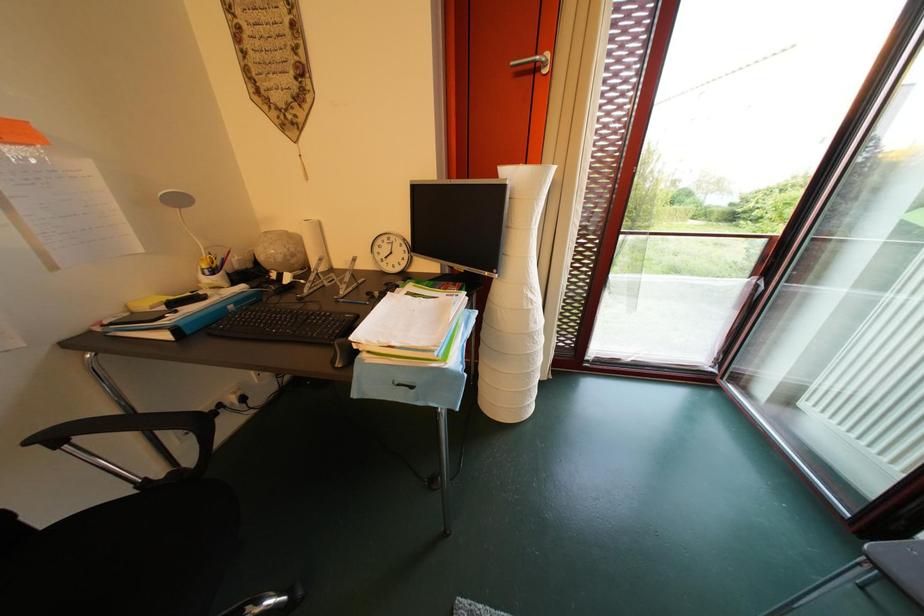
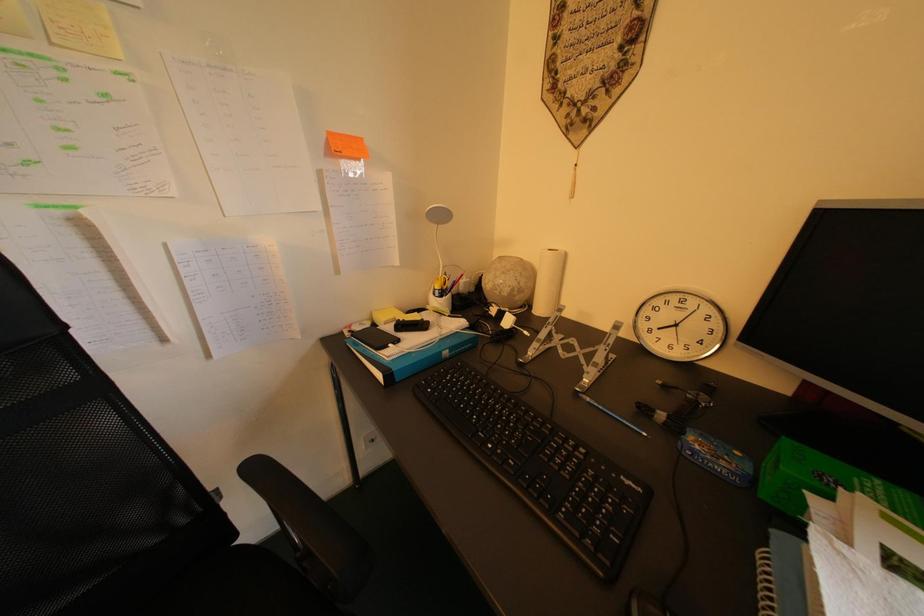
Question: The camera is either moving clockwise (left) or counter-clockwise (right) around the object. The first image is from the beginning of the video and the second image is from the end. Is the camera moving left or right when shooting the video?

Choices:
 (A) Left
 (B) Right

Answer: (B)